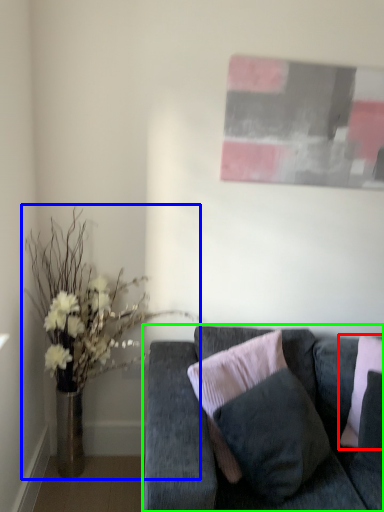
Question: Which object is positioned closest to pillow (highlighted by a red box)? Select from houseplant (highlighted by a blue box) and studio couch (highlighted by a green box).

Choices:
 (A) houseplant
 (B) studio couch

Answer: (B)